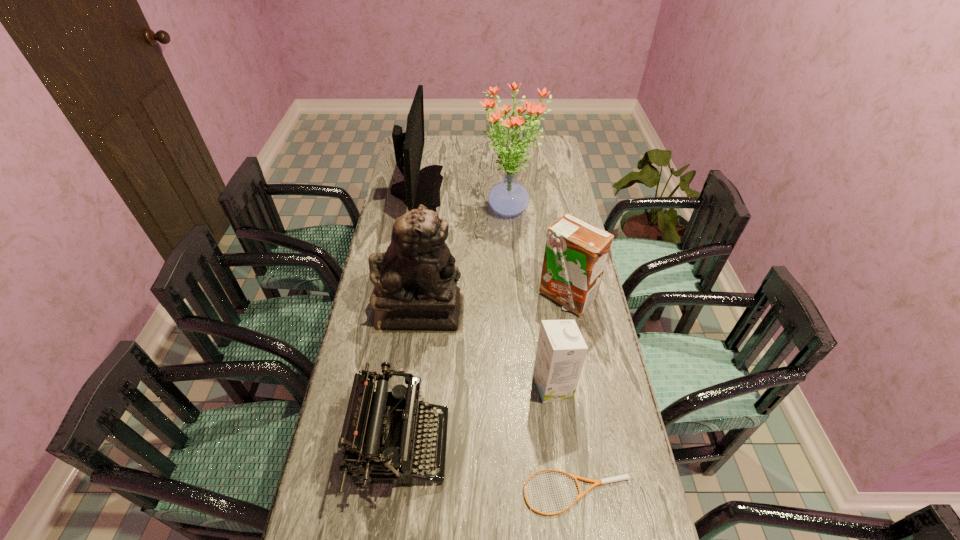
At what (x,y) coordinates should I click in order to perform the action: click on object that is at the far left corner. Please return your answer as a coordinate pair (x, y). The image size is (960, 540). Looking at the image, I should click on (423, 186).

In the image, there is a desktop. Where is `vacant space at the far edge`? This screenshot has height=540, width=960. vacant space at the far edge is located at coordinates (467, 144).

Locate an element on the screen. The height and width of the screenshot is (540, 960). blank space at the right edge is located at coordinates (550, 309).

This screenshot has height=540, width=960. I want to click on vacant space at the far right corner of the desktop, so click(549, 153).

Image resolution: width=960 pixels, height=540 pixels. Find the location of `free spot between the tennis racket and the sculpture`. free spot between the tennis racket and the sculpture is located at coordinates (499, 402).

The image size is (960, 540). I want to click on free area in between the sixth tallest object and the tennis racket, so click(490, 470).

In order to click on free space between the sculpture and the farther carton in this screenshot , I will do `click(493, 303)`.

The width and height of the screenshot is (960, 540). What are the coordinates of `vacant space that is in between the tallest object and the farther carton` in the screenshot? It's located at (538, 253).

In order to click on free area in between the flower arrangement and the nearer carton in this screenshot , I will do `click(532, 298)`.

In order to click on empty location between the farther carton and the flower arrangement in this screenshot , I will do `click(538, 253)`.